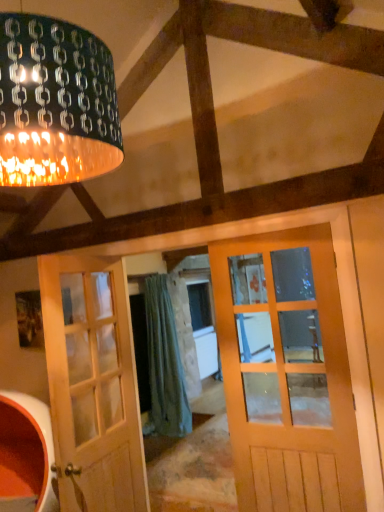
Question: From the image's perspective, is matte black lampshade at upper left on top of white wood door at left?

Choices:
 (A) yes
 (B) no

Answer: (A)

Question: Is matte black lampshade at upper left outside of white wood door at left?

Choices:
 (A) no
 (B) yes

Answer: (B)

Question: Is matte black lampshade at upper left to the right of white wood door at left from the viewer's perspective?

Choices:
 (A) yes
 (B) no

Answer: (B)

Question: From a real-world perspective, is matte black lampshade at upper left over white wood door at left?

Choices:
 (A) no
 (B) yes

Answer: (B)

Question: From a real-world perspective, does matte black lampshade at upper left sit lower than white wood door at left?

Choices:
 (A) no
 (B) yes

Answer: (A)

Question: From the image's perspective, is white wood door at left above or below matte black lampshade at upper left?

Choices:
 (A) above
 (B) below

Answer: (B)

Question: In terms of size, does white wood door at left appear bigger or smaller than matte black lampshade at upper left?

Choices:
 (A) small
 (B) big

Answer: (A)

Question: In terms of width, does white wood door at left look wider or thinner when compared to matte black lampshade at upper left?

Choices:
 (A) wide
 (B) thin

Answer: (B)

Question: Which is correct: white wood door at left is inside matte black lampshade at upper left, or outside of it?

Choices:
 (A) inside
 (B) outside

Answer: (B)

Question: In terms of height, does matte black lampshade at upper left look taller or shorter compared to green fabric curtain at center?

Choices:
 (A) short
 (B) tall

Answer: (A)

Question: In terms of width, does matte black lampshade at upper left look wider or thinner when compared to green fabric curtain at center?

Choices:
 (A) thin
 (B) wide

Answer: (B)

Question: Do you think matte black lampshade at upper left is within green fabric curtain at center, or outside of it?

Choices:
 (A) outside
 (B) inside

Answer: (A)

Question: Is point pyautogui.click(x=36, y=89) positioned closer to the camera than point pyautogui.click(x=160, y=293)?

Choices:
 (A) closer
 (B) farther

Answer: (A)

Question: In the image, is white wood door at left on the left side or the right side of green fabric curtain at center?

Choices:
 (A) left
 (B) right

Answer: (A)

Question: Is white wood door at left inside or outside of green fabric curtain at center?

Choices:
 (A) outside
 (B) inside

Answer: (A)